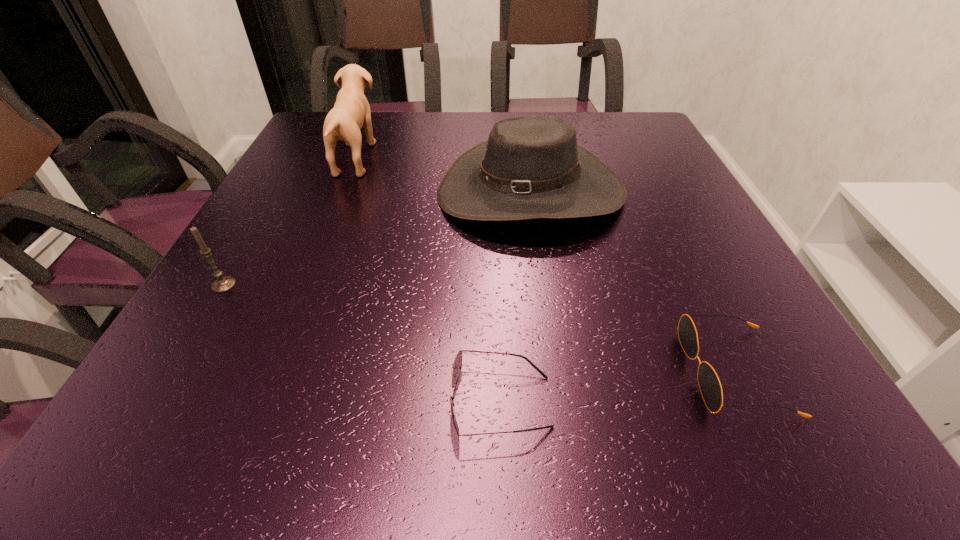
The image size is (960, 540). In order to click on vacant space located on the front-facing side of the right sunglasses in this screenshot , I will do `click(622, 372)`.

Identify the location of vacant space located 0.360m on the front-facing side of the right sunglasses. Image resolution: width=960 pixels, height=540 pixels. (448, 372).

Identify the location of vacant space located 0.130m on the front-facing side of the left sunglasses. The height and width of the screenshot is (540, 960). (359, 402).

You are a GUI agent. You are given a task and a screenshot of the screen. Output one action in this format:
    pyautogui.click(x=<x>, y=<y>)
    Task: Click on the vacant space located on the front-facing side of the left sunglasses
    The image size is (960, 540).
    Given the screenshot: What is the action you would take?
    pyautogui.click(x=239, y=402)

What are the coordinates of `free point located on the front-facing side of the left sunglasses` in the screenshot? It's located at (317, 402).

I want to click on object at the far edge, so click(351, 111).

I want to click on puppy that is at the left edge, so click(351, 111).

I want to click on candle at the left edge, so click(222, 284).

Find the location of a particular element. Image resolution: width=960 pixels, height=540 pixels. cowboy hat at the right edge is located at coordinates (531, 167).

Identify the location of sunglasses that is positioned at the right edge. (709, 383).